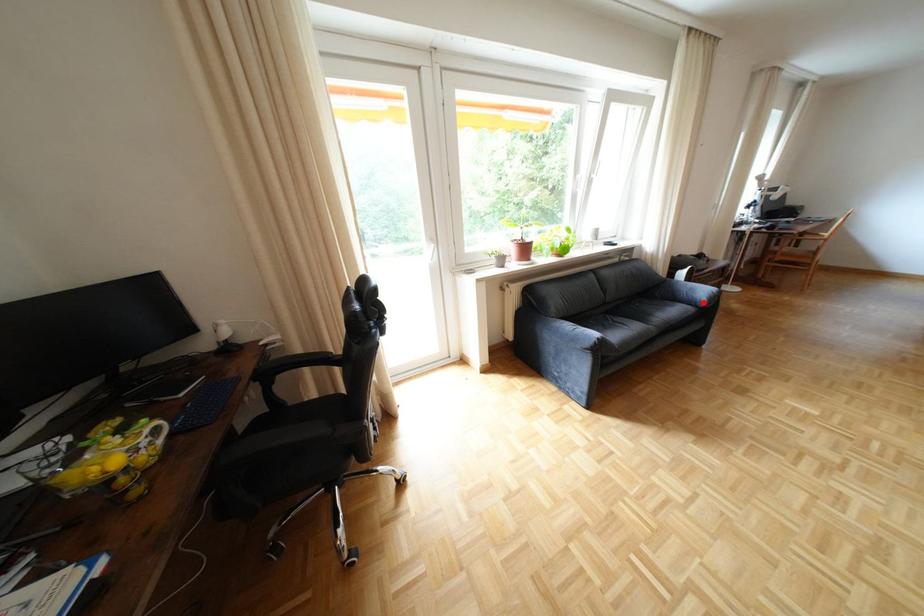
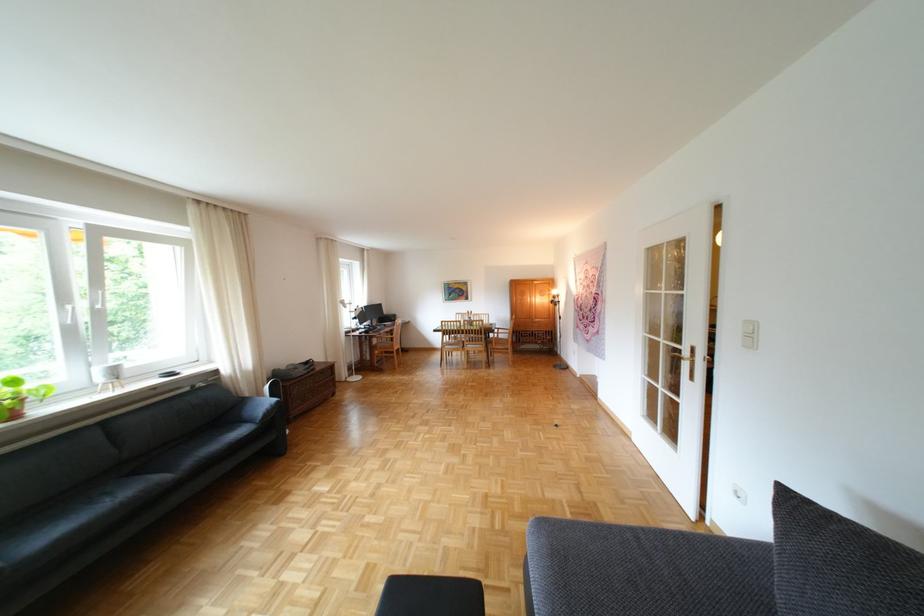
Locate, in the second image, the point that corresponds to the highlighted location in the first image.

(263, 421)